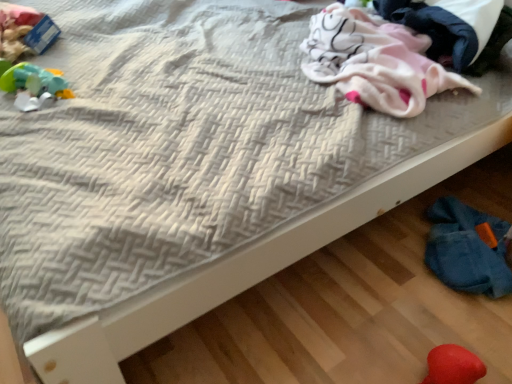
Question: Considering the relative sizes of fuzzy red heart at lower right, the 1th toy positioned from the bottom, and pink fleece blanket at upper right in the image provided, is fuzzy red heart at lower right, the 1th toy positioned from the bottom, taller than pink fleece blanket at upper right?

Choices:
 (A) yes
 (B) no

Answer: (B)

Question: Does fuzzy red heart at lower right, the 1th toy when ordered from front to back, have a smaller size compared to pink fleece blanket at upper right?

Choices:
 (A) yes
 (B) no

Answer: (A)

Question: Is pink fleece blanket at upper right inside fuzzy red heart at lower right, the 1th toy when ordered from front to back?

Choices:
 (A) no
 (B) yes

Answer: (A)

Question: Are fuzzy red heart at lower right, the 1th toy when ordered from front to back, and pink fleece blanket at upper right located far from each other?

Choices:
 (A) yes
 (B) no

Answer: (B)

Question: Can you confirm if fuzzy red heart at lower right, which ranks as the 2th toy in top-to-bottom order, is wider than pink fleece blanket at upper right?

Choices:
 (A) yes
 (B) no

Answer: (B)

Question: Is fuzzy red heart at lower right, the 1th toy in the right-to-left sequence, spatially inside rubberized green toy at left, the 2th toy from the right, or outside of it?

Choices:
 (A) outside
 (B) inside

Answer: (A)

Question: In terms of size, does fuzzy red heart at lower right, the 1th toy positioned from the bottom, appear bigger or smaller than rubberized green toy at left, the 2th toy when ordered from bottom to top?

Choices:
 (A) big
 (B) small

Answer: (B)

Question: From their relative heights in the image, would you say fuzzy red heart at lower right, which is the second toy in back-to-front order, is taller or shorter than rubberized green toy at left, acting as the 2th toy starting from the front?

Choices:
 (A) short
 (B) tall

Answer: (B)

Question: From the image's perspective, is fuzzy red heart at lower right, the 1th toy when ordered from front to back, positioned above or below rubberized green toy at left, the 2th toy when ordered from bottom to top?

Choices:
 (A) below
 (B) above

Answer: (A)

Question: Considering the positions of pink fleece blanket at upper right and pink soft fabric at upper right in the image, is pink fleece blanket at upper right taller or shorter than pink soft fabric at upper right?

Choices:
 (A) short
 (B) tall

Answer: (A)

Question: Looking at their shapes, would you say pink fleece blanket at upper right is wider or thinner than pink soft fabric at upper right?

Choices:
 (A) thin
 (B) wide

Answer: (B)

Question: From a real-world perspective, relative to pink soft fabric at upper right, is pink fleece blanket at upper right vertically above or below?

Choices:
 (A) below
 (B) above

Answer: (A)

Question: Is pink fleece blanket at upper right bigger or smaller than pink soft fabric at upper right?

Choices:
 (A) small
 (B) big

Answer: (B)

Question: From a real-world perspective, is pink soft fabric at upper right physically located above or below rubberized green toy at left, acting as the 2th toy starting from the front?

Choices:
 (A) above
 (B) below

Answer: (A)

Question: Based on their sizes in the image, would you say pink soft fabric at upper right is bigger or smaller than rubberized green toy at left, which is the first toy from back to front?

Choices:
 (A) big
 (B) small

Answer: (A)